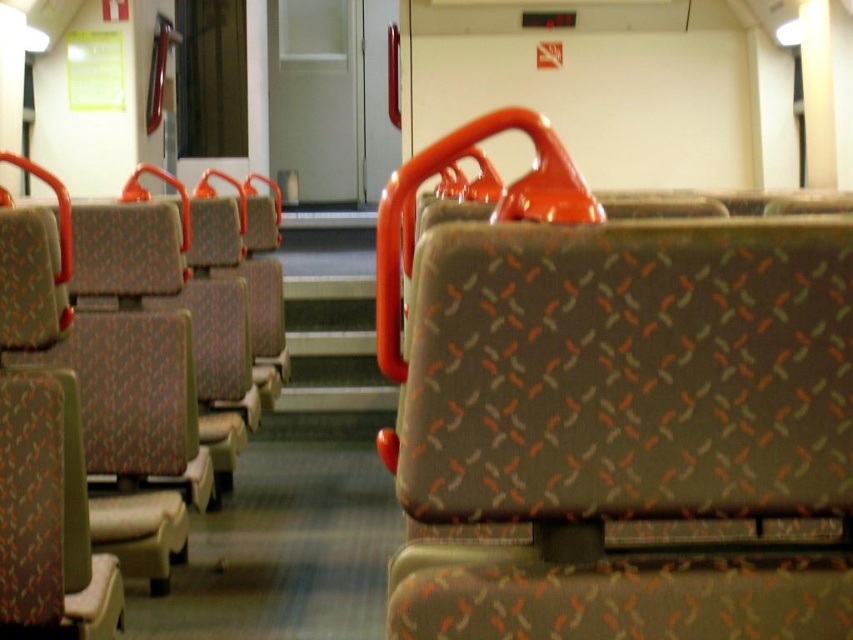
Can you confirm if textured fabric seat at center is taller than patterned fabric seat at center?

No.

Does point (682, 355) lie behind point (105, 333)?

No, it is in front of (105, 333).

What do you see at coordinates (614, 404) in the screenshot? The height and width of the screenshot is (640, 853). I see `textured fabric seat at center` at bounding box center [614, 404].

The height and width of the screenshot is (640, 853). I want to click on textured fabric seat at center, so click(x=614, y=404).